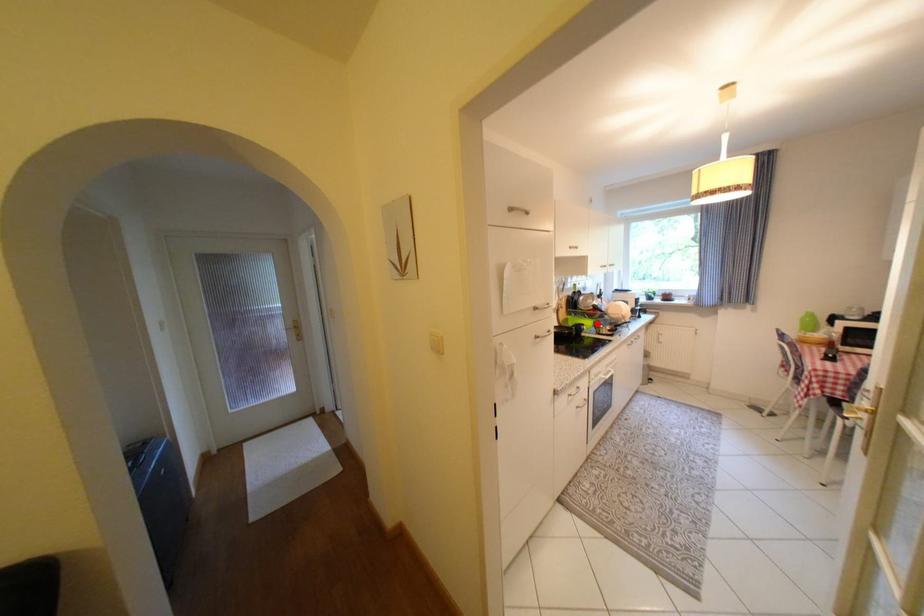
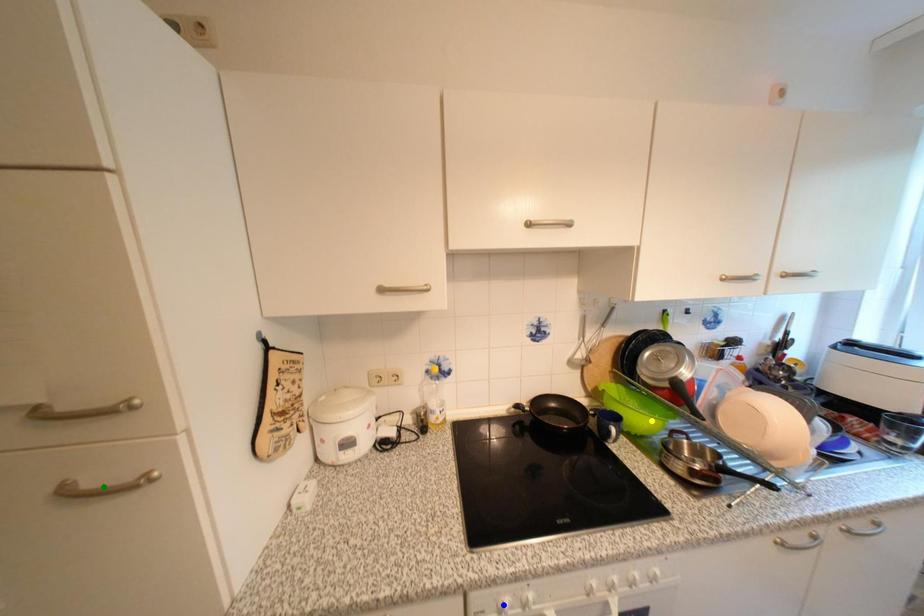
Question: I am providing you with two images of the same scene from different viewpoints. A red point is marked on the first image. You are given multiple points on the second image. Can you choose the point in image 2 that corresponds to the point in image 1?

Choices:
 (A) yellow point
 (B) green point
 (C) blue point

Answer: (A)